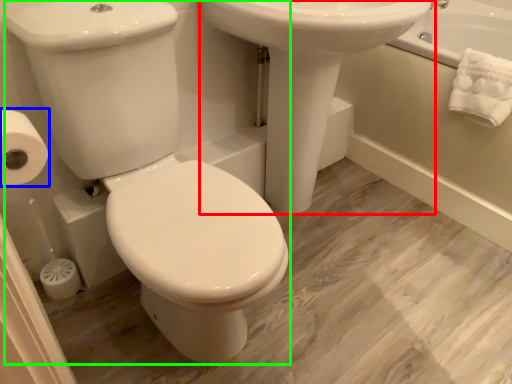
Question: Based on their relative distances, which object is nearer to sink (highlighted by a red box)? Choose from toilet paper (highlighted by a blue box) and porcelain (highlighted by a green box).

Choices:
 (A) toilet paper
 (B) porcelain

Answer: (B)